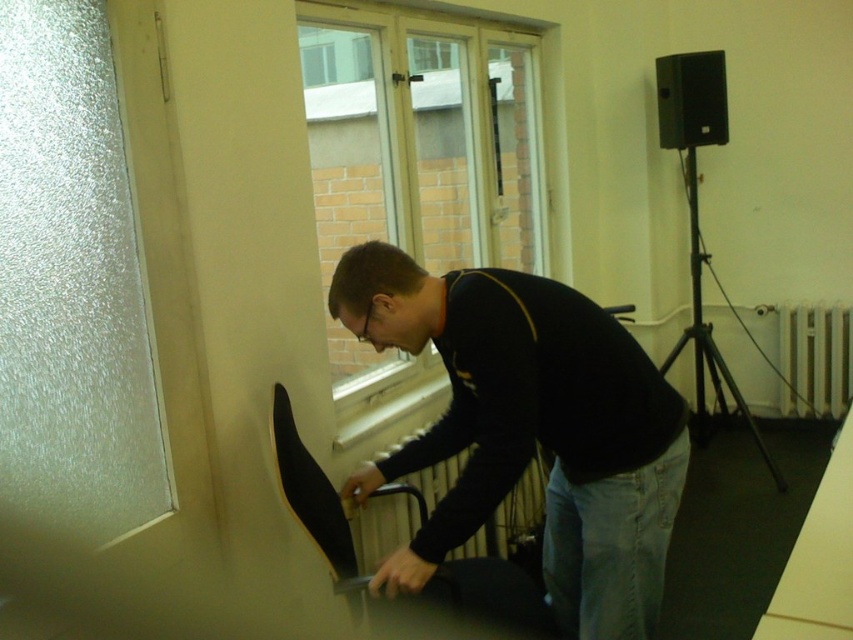
You are standing in the room and want to place a new radiator cover that needs to be placed exactly at point 0.672, 0.621. Is the black matte sweater at center currently occupying that spot?

The black matte sweater at center is located at point 0.621, so yes, it is occupying that spot and the radiator cover cannot be placed there.

You are a photographer setting up equipment in the room. You have a large camera that needs to be placed on a stable surface. The camera is too heavy for the skateboard. Which object, the clear glass window at upper center or the black matte tripod at right, would be more suitable for placing the camera?

The black matte tripod at right is more suitable for placing the camera because tripods are designed to support heavy equipment, whereas windows are not stable surfaces for such items.

You are a home inspector checking the room for potential safety hazards. You notice the denim at lower center and the metallic radiator at center. Which object is covering the other?

The denim at lower center is positioned over the metallic radiator at center, so it is covering the latter.